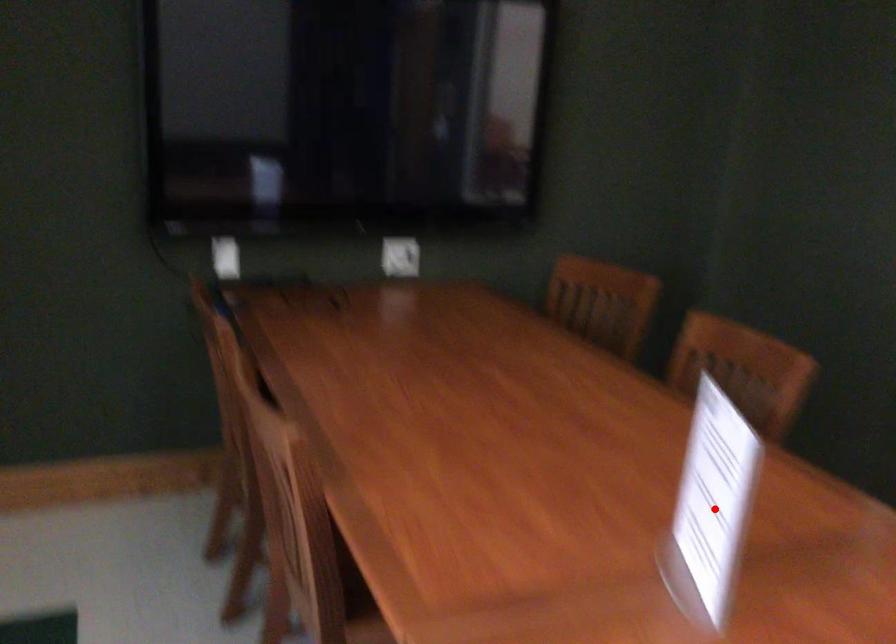
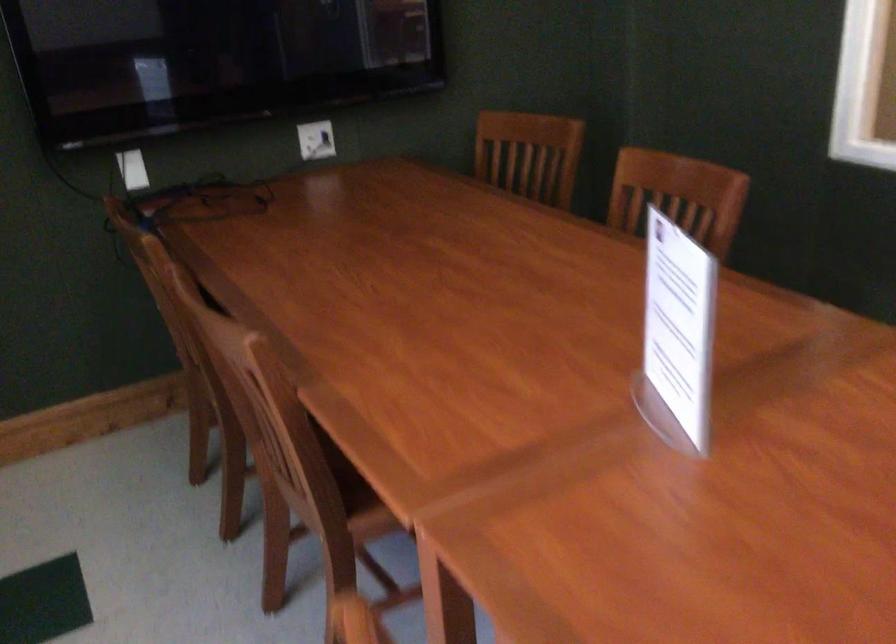
Find the pixel in the second image that matches the highlighted location in the first image.

(677, 335)